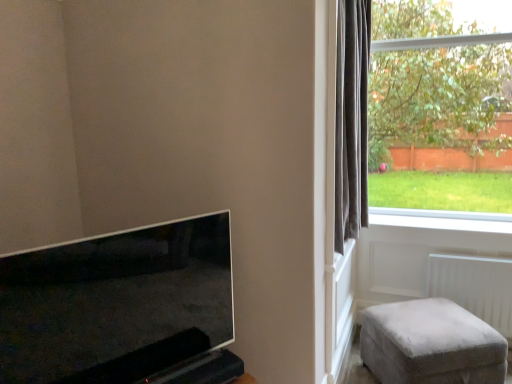
What are the coordinates of `blank space situated above matte black tv at lower left (from a real-world perspective)` in the screenshot? It's located at (121, 234).